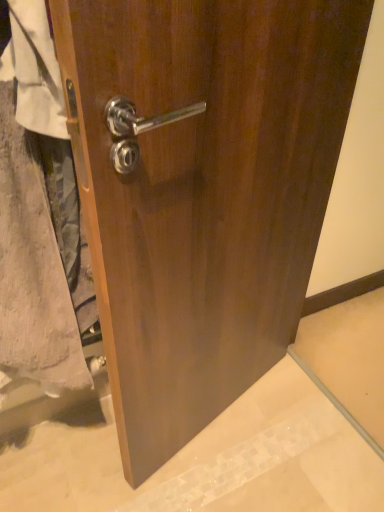
Question: Should I look upward or downward to see white fabric at left?

Choices:
 (A) up
 (B) down

Answer: (B)